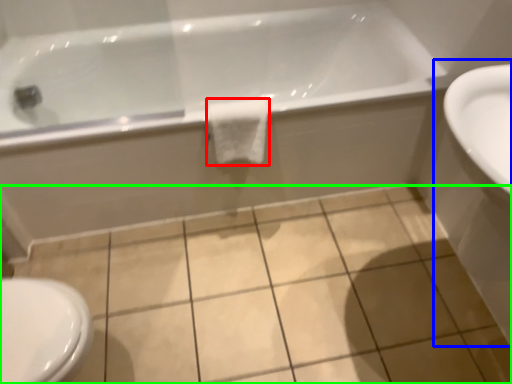
Question: Which object is positioned closest to bath towel (highlighted by a red box)? Select from sink (highlighted by a blue box) and ceramic tile (highlighted by a green box).

Choices:
 (A) sink
 (B) ceramic tile

Answer: (B)